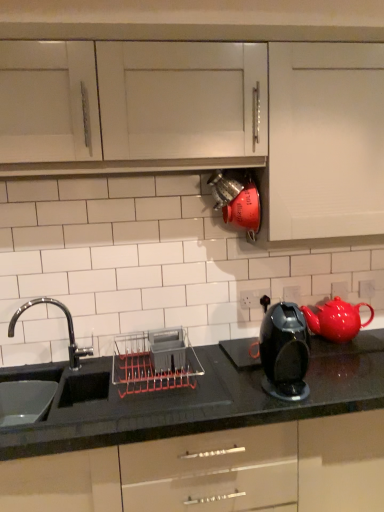
You are a GUI agent. You are given a task and a screenshot of the screen. Output one action in this format:
    pyautogui.click(x=<x>, y=<y>)
    Task: Click on the vacant point to the left of glossy black coffee maker at center-right
    
    Given the screenshot: What is the action you would take?
    pyautogui.click(x=231, y=397)